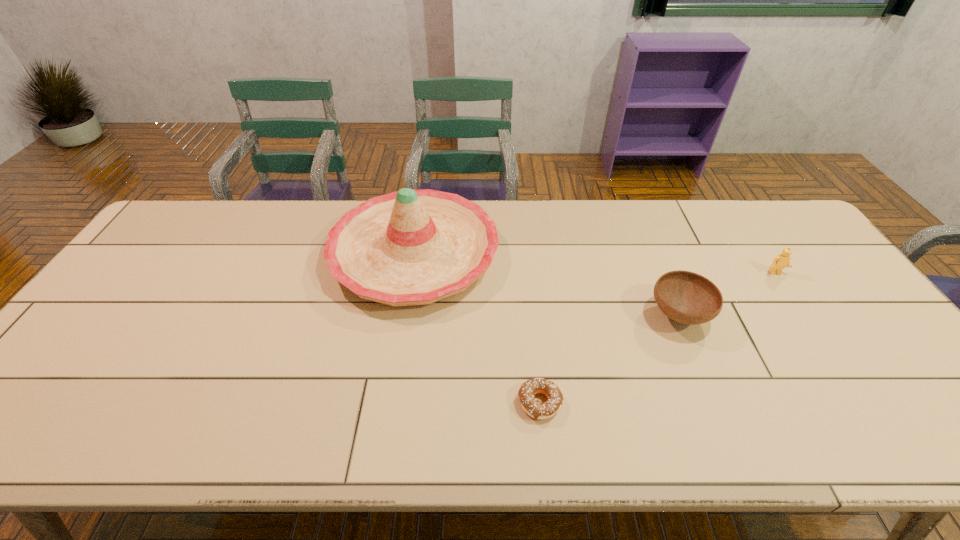
Identify the location of object that is the second closest to the rightmost object. This screenshot has height=540, width=960. (534, 408).

Image resolution: width=960 pixels, height=540 pixels. Find the location of `vacant region that satisfies the following two spatial constraints: 1. on the back side of the bowl; 2. on the right side of the shortest object`. vacant region that satisfies the following two spatial constraints: 1. on the back side of the bowl; 2. on the right side of the shortest object is located at coordinates (531, 315).